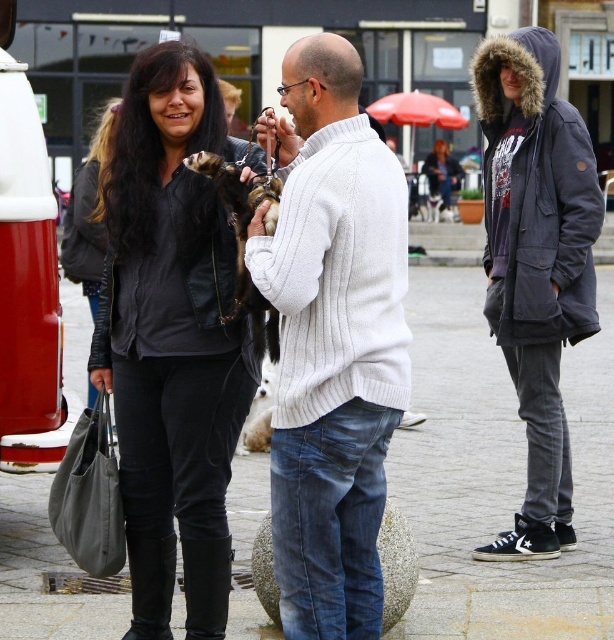
You are standing in the plaza and want to hand a flyer to the person wearing the black leather jacket at upper left and the dark blue hooded parka at right. Which person should you approach first to ensure you reach them in the shortest distance?

You should approach the black leather jacket at upper left first because it is closer to you than the dark blue hooded parka at right, so reaching it requires less distance.

You are organizing a photo shoot and need to place the dark blue hooded parka at right and the furry black ferret at center into a display case. The case has a maximum capacity of 1.2 cubic meters. If the parka takes up 0.8 cubic meters, will the ferret also fit inside?

The dark blue hooded parka at right is larger in size than the furry black ferret at center. Since the parka occupies 0.8 cubic meters, the ferret would require less space. The total would be under 1.2 cubic meters, so both can fit.